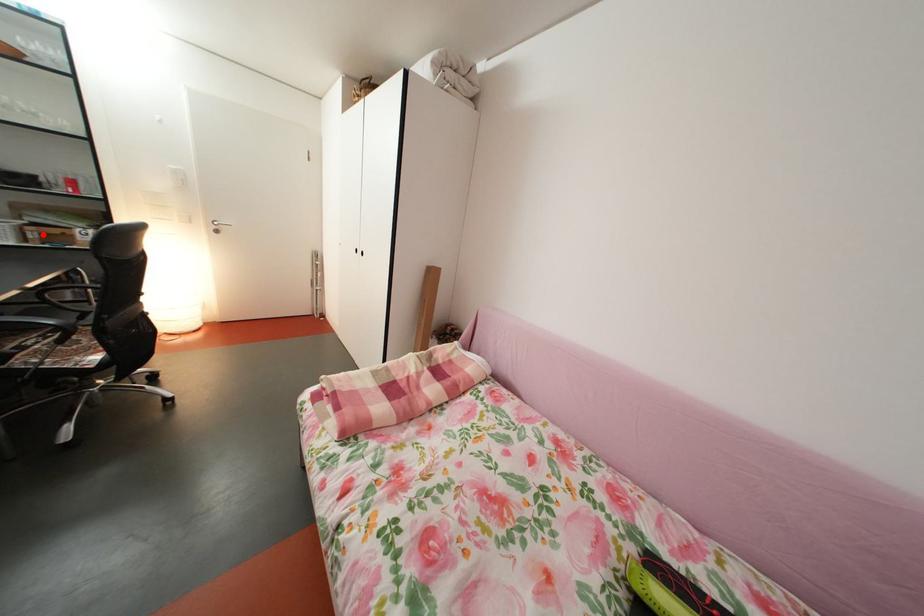
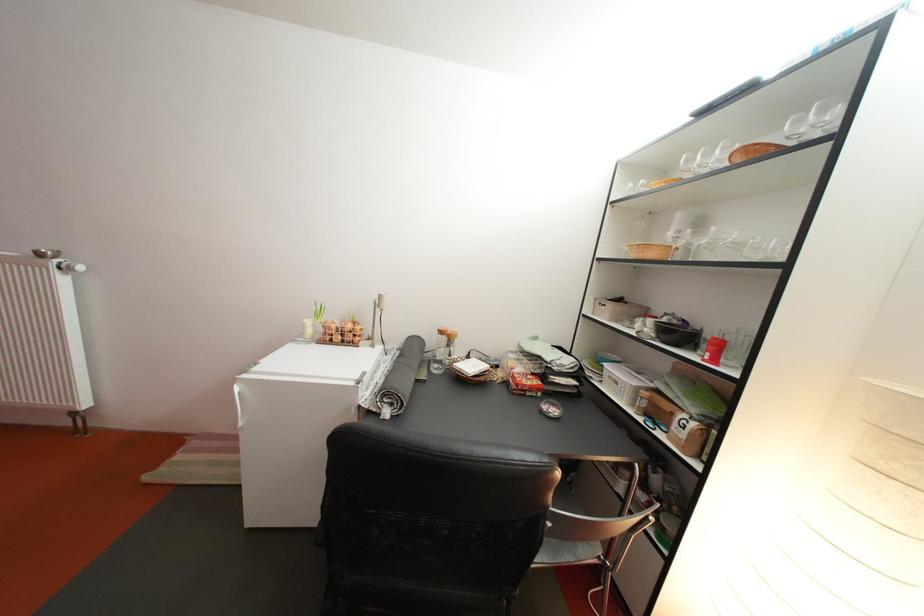
Locate, in the second image, the point that corresponds to the highlighted location in the first image.

(658, 400)